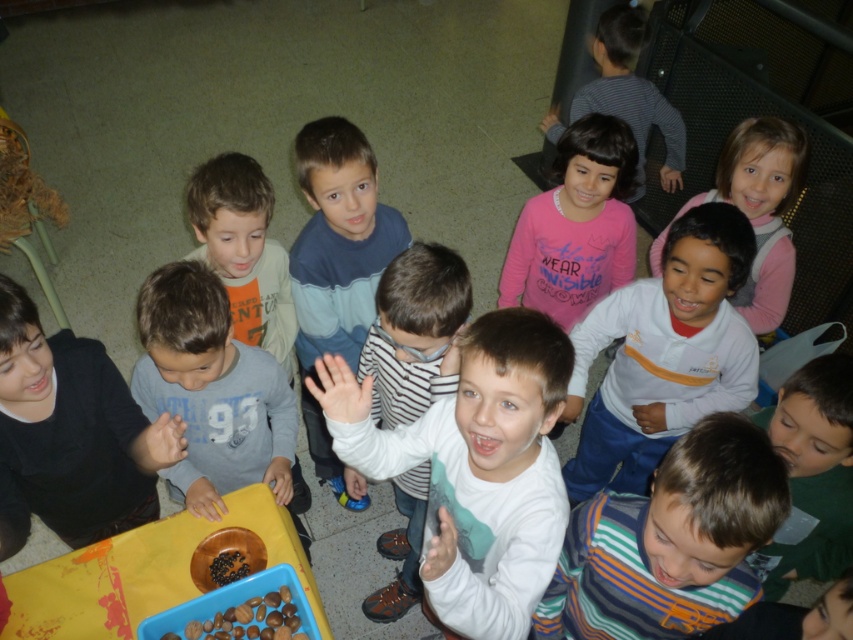
You are a teacher observing the scene. You notice two shirts at the center of the table. Which shirt is positioned lower on the table between the striped cotton shirt at center and the white cotton shirt at center?

The striped cotton shirt at center is located below the white cotton shirt at center, so it is positioned lower on the table.